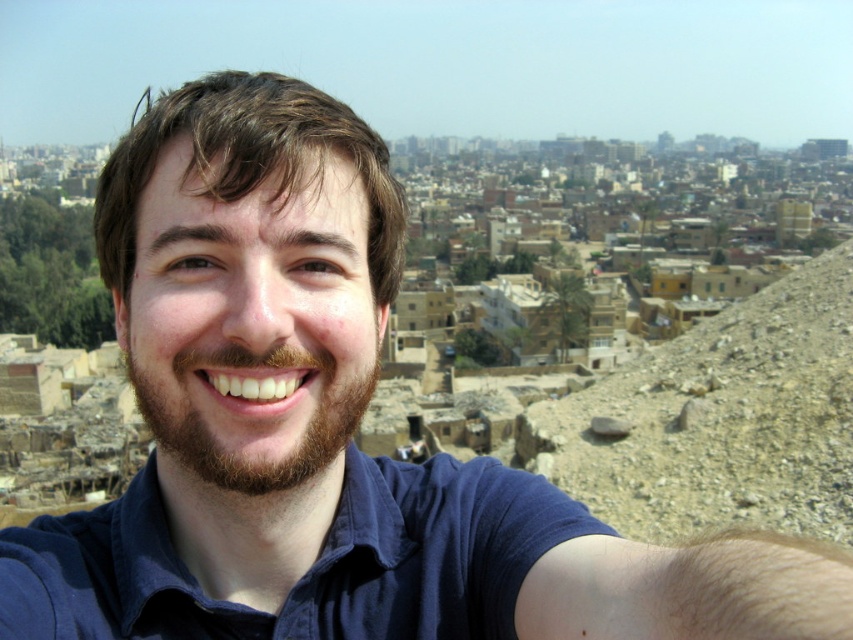
Question: Observing the image, what is the correct spatial positioning of brown rocky hillside at right in reference to brownwoollybeard at center?

Choices:
 (A) left
 (B) right

Answer: (B)

Question: Is brown rocky hillside at right smaller than brownwoollybeard at center?

Choices:
 (A) yes
 (B) no

Answer: (B)

Question: Among these points, which one is farthest from the camera?

Choices:
 (A) (320, 394)
 (B) (817, 456)

Answer: (B)

Question: Which point appears farthest from the camera in this image?

Choices:
 (A) (515, 449)
 (B) (334, 422)

Answer: (A)

Question: Does brown rocky hillside at right appear over brownwoollybeard at center?

Choices:
 (A) no
 (B) yes

Answer: (B)

Question: Which point is closer to the camera?

Choices:
 (A) brownwoollybeard at center
 (B) brown rocky hillside at right

Answer: (A)